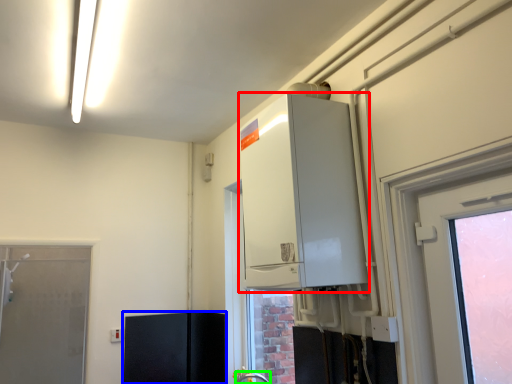
Question: Which is farther away from appliance (highlighted by a red box)? cabinetry (highlighted by a blue box) or faucet (highlighted by a green box)?

Choices:
 (A) cabinetry
 (B) faucet

Answer: (A)